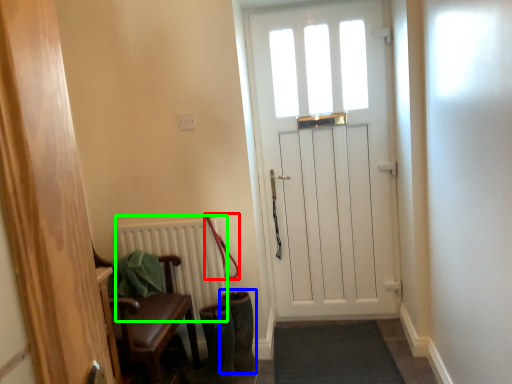
Question: Considering the real-world distances, which object is farthest from leash (highlighted by a red box)? boot (highlighted by a blue box) or radiator (highlighted by a green box)?

Choices:
 (A) boot
 (B) radiator

Answer: (A)